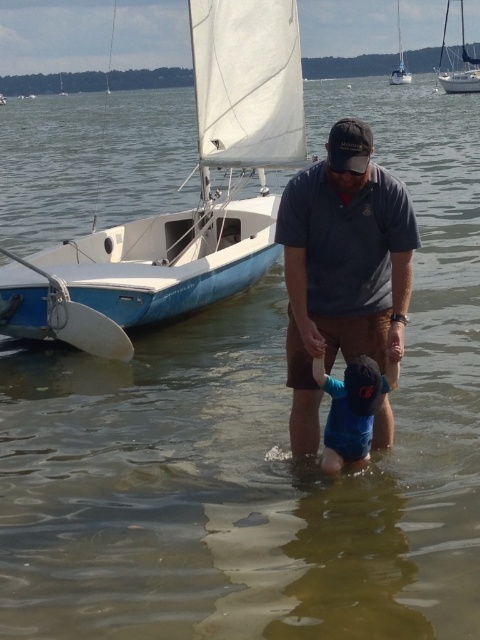
Between blue matte sailboat at left and dark gray cotton shirt at center, which one has less height?

blue matte sailboat at left

Is blue matte sailboat at left wider than dark gray cotton shirt at center?

Correct, the width of blue matte sailboat at left exceeds that of dark gray cotton shirt at center.

Between point (0, 273) and point (319, 284), which one is positioned behind?

The point (0, 273) is more distant.

You are a GUI agent. You are given a task and a screenshot of the screen. Output one action in this format:
    pyautogui.click(x=<x>, y=<y>)
    Task: Click on the blue matte sailboat at left
    The width and height of the screenshot is (480, 640).
    Given the screenshot: What is the action you would take?
    pyautogui.click(x=184, y=211)

Who is lower down, white sailboat at upper center or white sailboat at left?

Positioned lower is white sailboat at left.

From the picture: Is white sailboat at upper center above white sailboat at left?

Yes, white sailboat at upper center is above white sailboat at left.

Where is `white sailboat at upper center`? The image size is (480, 640). white sailboat at upper center is located at coordinates (399, 58).

Identify the location of white sailboat at upper center. This screenshot has height=640, width=480. (399, 58).

Between white sailboat at upper right and white sailboat at upper left, which one is positioned lower?

white sailboat at upper left is below.

Consider the image. Who is more forward, (466, 84) or (60, 77)?

Point (466, 84) is in front.

Is point (476, 74) positioned before point (61, 77)?

That is True.

Locate an element on the screen. The height and width of the screenshot is (640, 480). white sailboat at upper right is located at coordinates (460, 61).